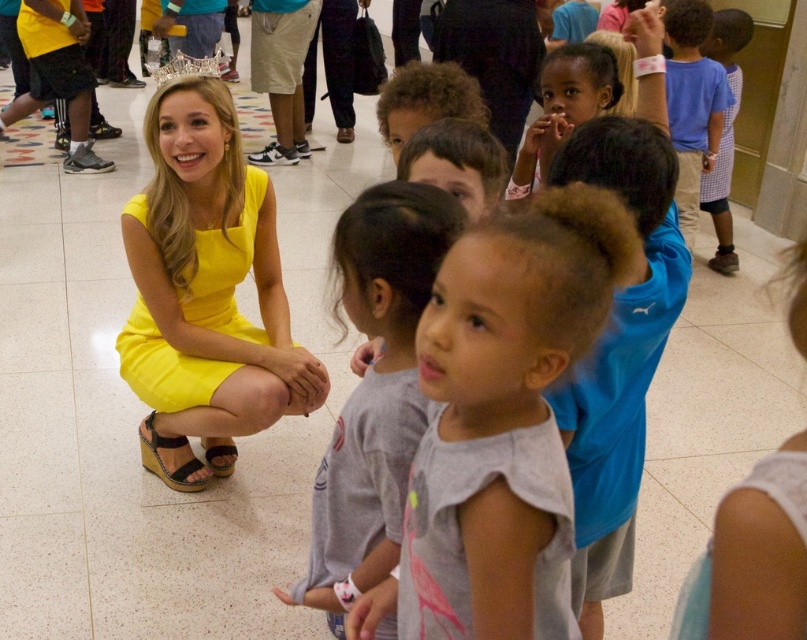
You are a fashion designer observing the image. You need to determine which item has a greater horizontal span between the yellow satin dress at center and the clear crystal crown at upper center. Which one is wider?

The yellow satin dress at center is wider than the clear crystal crown at upper center.